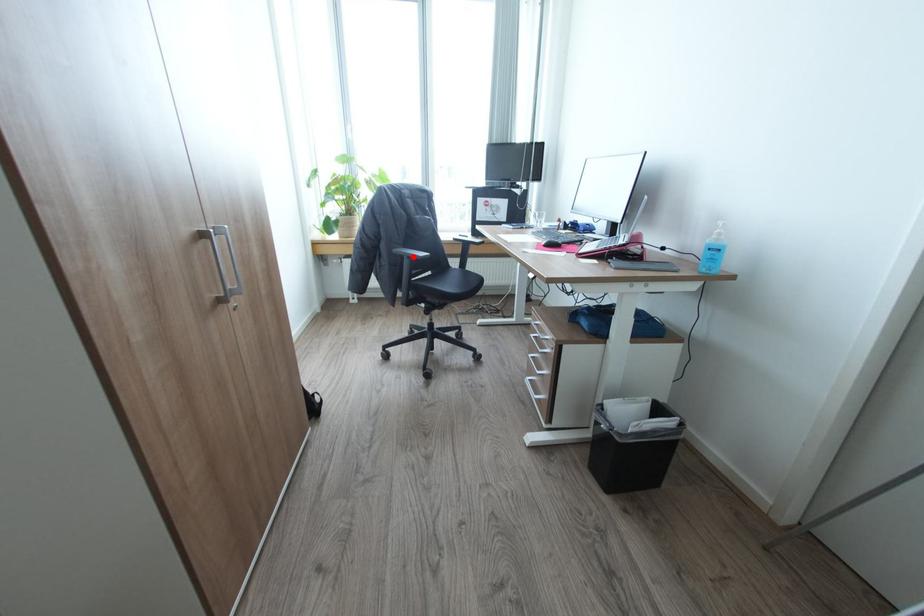
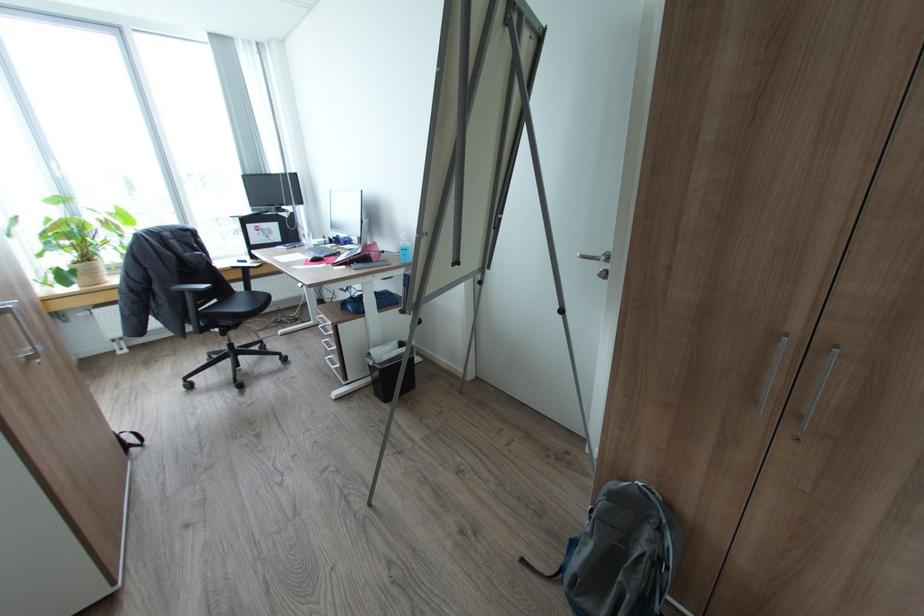
Question: I am providing you with two images of the same scene from different viewpoints. Image1 has a red point marked. In image2, the corresponding 3D location appears at what relative position? Reply with the corresponding letter.

Choices:
 (A) Closer
 (B) Farther

Answer: (B)